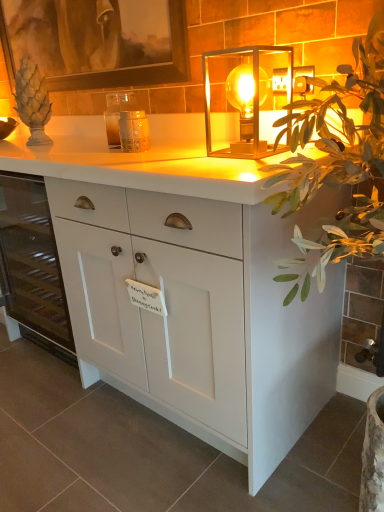
Question: Considering the relative sizes of translucent glass candle holder at center and wooden picture frame at upper left in the image provided, is translucent glass candle holder at center shorter than wooden picture frame at upper left?

Choices:
 (A) no
 (B) yes

Answer: (B)

Question: From a real-world perspective, is translucent glass candle holder at center located beneath wooden picture frame at upper left?

Choices:
 (A) no
 (B) yes

Answer: (B)

Question: Is translucent glass candle holder at center positioned before wooden picture frame at upper left?

Choices:
 (A) yes
 (B) no

Answer: (A)

Question: From the image's perspective, does translucent glass candle holder at center appear higher than wooden picture frame at upper left?

Choices:
 (A) no
 (B) yes

Answer: (A)

Question: Does translucent glass candle holder at center have a greater height compared to wooden picture frame at upper left?

Choices:
 (A) no
 (B) yes

Answer: (A)

Question: Is translucent glass candle holder at center in contact with wooden picture frame at upper left?

Choices:
 (A) yes
 (B) no

Answer: (B)

Question: Can you confirm if white matte cabinet at left is taller than wooden picture frame at upper left?

Choices:
 (A) no
 (B) yes

Answer: (B)

Question: Is white matte cabinet at left further to the viewer compared to wooden picture frame at upper left?

Choices:
 (A) yes
 (B) no

Answer: (A)

Question: Is white matte cabinet at left aimed at wooden picture frame at upper left?

Choices:
 (A) no
 (B) yes

Answer: (A)

Question: Does white matte cabinet at left touch wooden picture frame at upper left?

Choices:
 (A) yes
 (B) no

Answer: (B)

Question: Considering the relative positions of white matte cabinet at left and wooden picture frame at upper left in the image provided, is white matte cabinet at left in front of wooden picture frame at upper left?

Choices:
 (A) no
 (B) yes

Answer: (A)

Question: Is white matte cabinet at left bigger than wooden picture frame at upper left?

Choices:
 (A) yes
 (B) no

Answer: (A)

Question: Is white matte cabinet at center bigger than white matte cabinet at left?

Choices:
 (A) yes
 (B) no

Answer: (B)